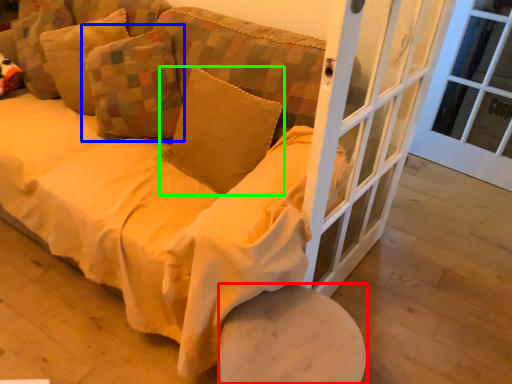
Question: Based on their relative distances, which object is nearer to furniture (highlighted by a red box)? Choose from pillow (highlighted by a blue box) and pillow (highlighted by a green box).

Choices:
 (A) pillow
 (B) pillow

Answer: (B)